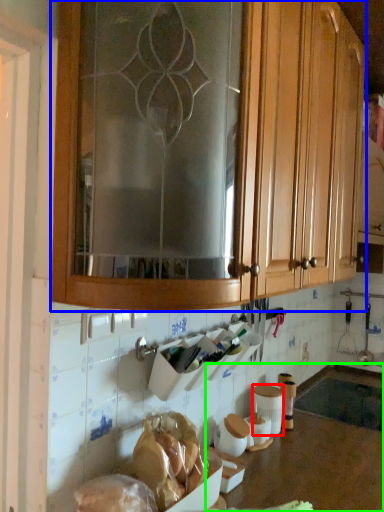
Question: Estimate the real-world distances between objects in this image. Which object is closer to pottery (highlighted by a red box), cabinetry (highlighted by a blue box) or counter top (highlighted by a green box)?

Choices:
 (A) cabinetry
 (B) counter top

Answer: (B)